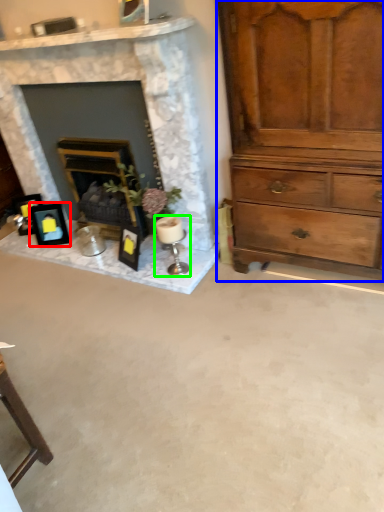
Question: Which object is positioned farthest from picture frame (highlighted by a red box)? Select from chest of drawers (highlighted by a blue box) and candle holder (highlighted by a green box).

Choices:
 (A) chest of drawers
 (B) candle holder

Answer: (A)